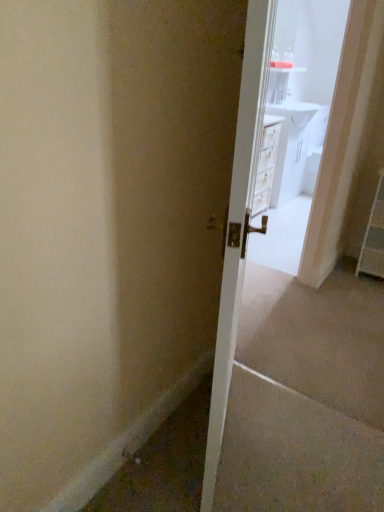
Question: Can you confirm if white glossy door at center is thinner than white glossy vanity at upper center?

Choices:
 (A) no
 (B) yes

Answer: (B)

Question: Considering the relative sizes of white glossy door at center and white glossy vanity at upper center in the image provided, is white glossy door at center taller than white glossy vanity at upper center?

Choices:
 (A) no
 (B) yes

Answer: (B)

Question: Is white glossy door at center aimed at white glossy vanity at upper center?

Choices:
 (A) no
 (B) yes

Answer: (A)

Question: From the image's perspective, is white glossy door at center on white glossy vanity at upper center?

Choices:
 (A) yes
 (B) no

Answer: (B)

Question: Could white glossy vanity at upper center be considered to be inside white glossy door at center?

Choices:
 (A) yes
 (B) no

Answer: (B)

Question: From the image's perspective, relative to white plastic dresser at right, is white glossy door at center above or below?

Choices:
 (A) below
 (B) above

Answer: (A)

Question: In terms of height, does white glossy door at center look taller or shorter compared to white plastic dresser at right?

Choices:
 (A) tall
 (B) short

Answer: (A)

Question: Which is correct: white glossy door at center is inside white plastic dresser at right, or outside of it?

Choices:
 (A) outside
 (B) inside

Answer: (A)

Question: In terms of width, does white glossy door at center look wider or thinner when compared to white plastic dresser at right?

Choices:
 (A) thin
 (B) wide

Answer: (A)

Question: From their relative heights in the image, would you say white plastic dresser at right is taller or shorter than white glossy door at center?

Choices:
 (A) short
 (B) tall

Answer: (A)

Question: From a real-world perspective, is white plastic dresser at right above or below white glossy door at center?

Choices:
 (A) above
 (B) below

Answer: (B)

Question: Considering the positions of point (372, 209) and point (218, 337), is point (372, 209) closer or farther from the camera than point (218, 337)?

Choices:
 (A) closer
 (B) farther

Answer: (B)

Question: Is white plastic dresser at right in front of or behind white glossy door at center in the image?

Choices:
 (A) behind
 (B) front

Answer: (A)

Question: From the image's perspective, is white glossy door at center above or below white glossy vanity at upper center?

Choices:
 (A) above
 (B) below

Answer: (B)

Question: Is white glossy door at center wider or thinner than white glossy vanity at upper center?

Choices:
 (A) thin
 (B) wide

Answer: (A)